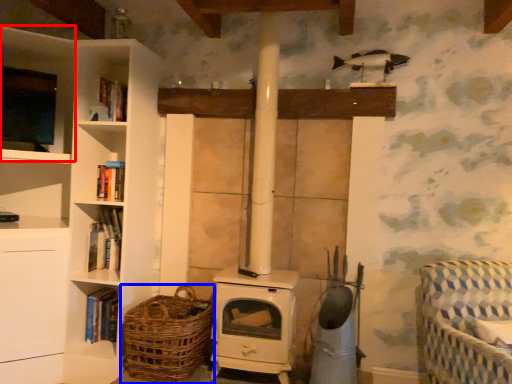
Question: Which object appears farthest to the camera in this image, shelf (highlighted by a red box) or basket (highlighted by a blue box)?

Choices:
 (A) shelf
 (B) basket

Answer: (A)